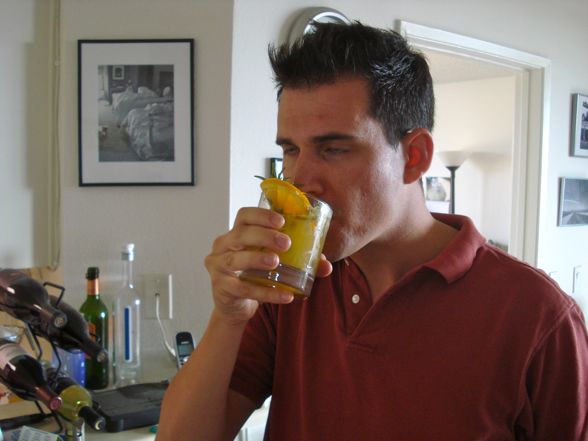
This screenshot has width=588, height=441. I want to click on phone, so click(x=180, y=349).